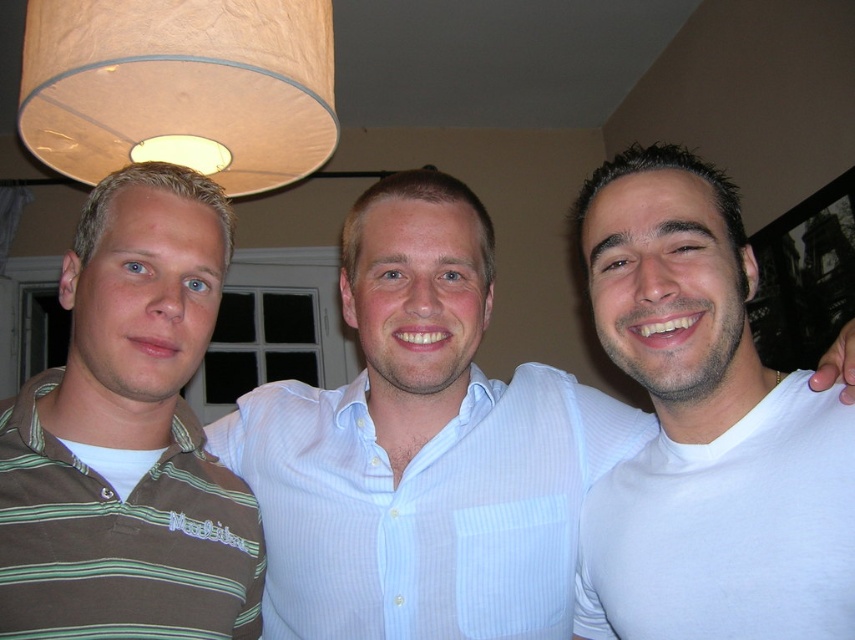
You are a photographer trying to capture a clear shot of the white striped shirt at center and the beige paper lampshade at upper center. Which object is closer to the camera?

The white striped shirt at center is positioned under the beige paper lampshade at upper center, so the white striped shirt at center is closer to the camera than the beige paper lampshade at upper center.

You are trying to hang a new lampshade that is 1 meter wide. You see the white striped shirt at center and the beige paper lampshade at upper center. Which object can the new lampshade fit over without overlapping?

The beige paper lampshade at upper center can fit the new lampshade since it has a greater width than the white striped shirt at center.